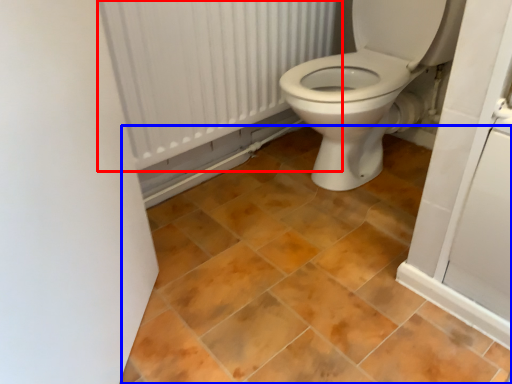
Question: Which object is closer to the camera taking this photo, radiator (highlighted by a red box) or ceramic tile (highlighted by a blue box)?

Choices:
 (A) radiator
 (B) ceramic tile

Answer: (B)